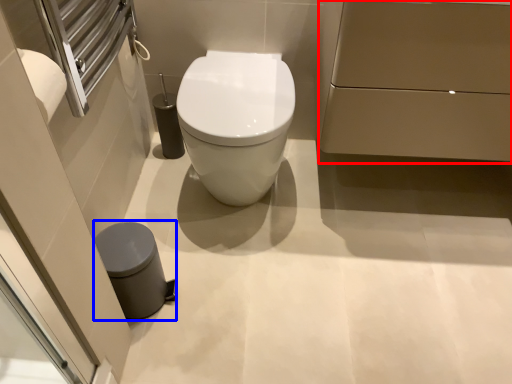
Question: Among these objects, which one is farthest to the camera, porcelain (highlighted by a red box) or porcelain (highlighted by a blue box)?

Choices:
 (A) porcelain
 (B) porcelain

Answer: (B)